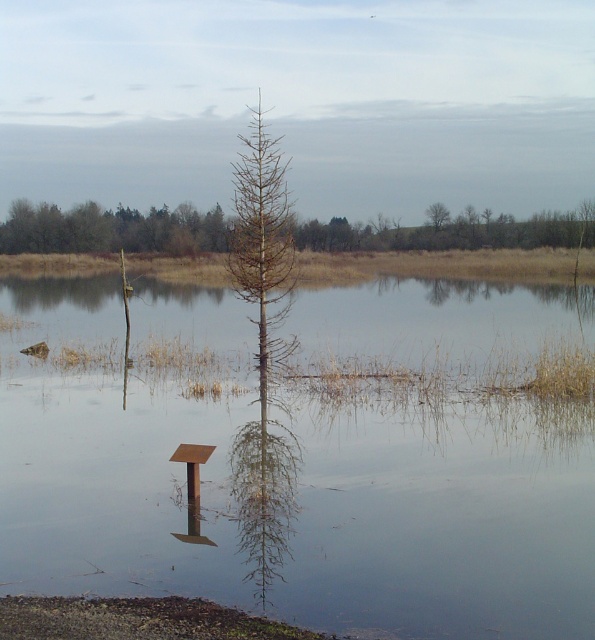
Question: Is brown/dried wood tree at upper center further to camera compared to brown textured tree at upper center?

Choices:
 (A) no
 (B) yes

Answer: (A)

Question: Which point is farther to the camera?

Choices:
 (A) tap(433, 212)
 (B) tap(65, 220)
 (C) tap(26, 212)

Answer: (C)

Question: Is brown/dried wood tree at upper center smaller than brown textured tree at upper center?

Choices:
 (A) no
 (B) yes

Answer: (A)

Question: Based on their relative distances, which object is nearer to the brown textured tree at upper center?

Choices:
 (A) brown/dried wood tree at upper center
 (B) brown wood tree at upper center

Answer: (A)

Question: Which point is farther to the camera?

Choices:
 (A) brown/dried wood tree at upper center
 (B) brown textured tree at upper center
 (C) brown wood tree at upper center

Answer: (B)

Question: From the image, what is the correct spatial relationship of brown/dried wood tree at upper center in relation to brown textured tree at upper center?

Choices:
 (A) above
 (B) below

Answer: (B)